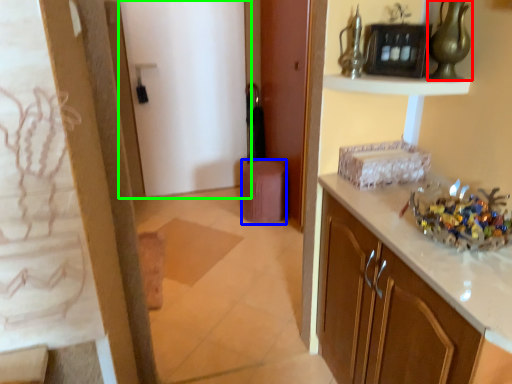
Question: Which object is the closest to the glass vase (highlighted by a red box)? Choose among these: stool (highlighted by a blue box) or door (highlighted by a green box).

Choices:
 (A) stool
 (B) door

Answer: (A)